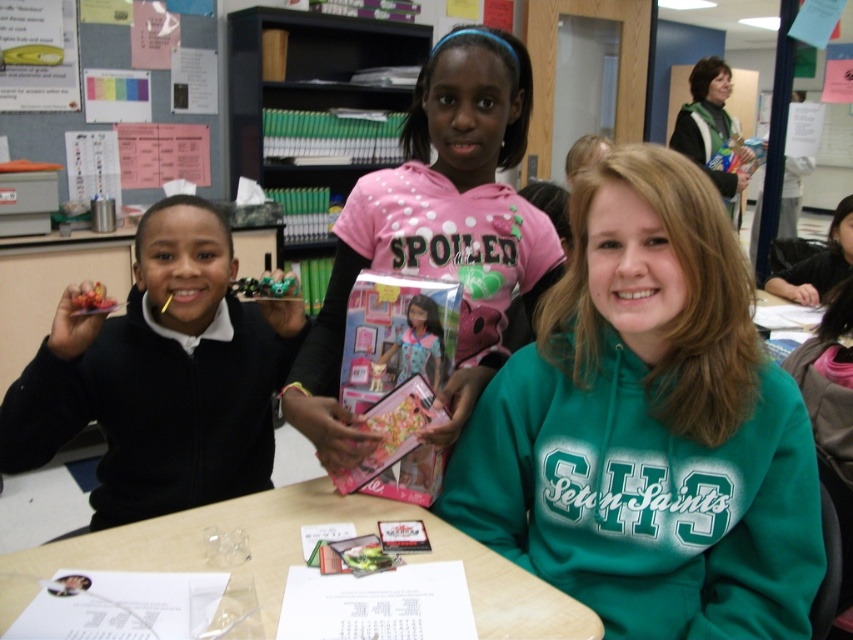
You are a teacher observing the children at the table. You notice the pink matte doll at center and the metallic green toy car at center. Which object is located to the right of the other?

The pink matte doll at center is positioned on the right side of metallic green toy car at center, so the doll is to the right of the car.

You are a photographer standing in front of the classroom scene. You need to focus your camera on both points, point (596,374) and point (251,289). Which point will require you to adjust the focus less because it is closer to you?

Point (596,374) is closer to the viewer than point (251,289), so focusing on point (596,374) will require less adjustment since it is nearer to you.

Based on the photo, what is located at the coordinates point (x=648, y=426)?

The green fleece sweatshirt at center is located at point (x=648, y=426).